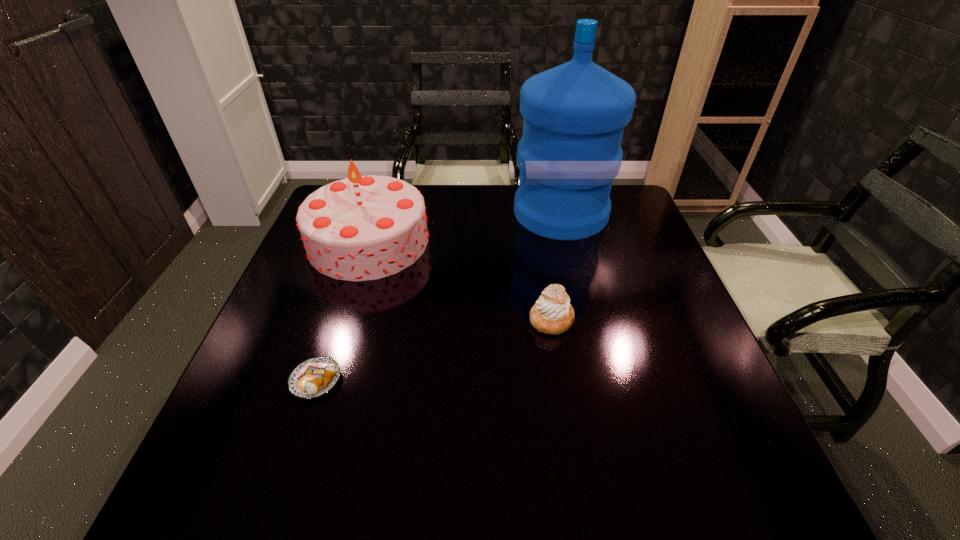
Where is `free point at the near left corner`? The width and height of the screenshot is (960, 540). free point at the near left corner is located at coordinates (221, 455).

Locate an element on the screen. vacant space at the near right corner of the desktop is located at coordinates (739, 476).

This screenshot has height=540, width=960. What are the coordinates of `free space between the tallest object and the birthday cake` in the screenshot? It's located at (465, 227).

You are a GUI agent. You are given a task and a screenshot of the screen. Output one action in this format:
    pyautogui.click(x=<x>, y=<y>)
    Task: Click on the free point between the third shortest object and the nearer pastry
    This screenshot has width=960, height=540.
    Given the screenshot: What is the action you would take?
    pyautogui.click(x=343, y=311)

Where is `free spot between the water jug and the birthday cake`? The height and width of the screenshot is (540, 960). free spot between the water jug and the birthday cake is located at coordinates (465, 227).

You are a GUI agent. You are given a task and a screenshot of the screen. Output one action in this format:
    pyautogui.click(x=<x>, y=<y>)
    Task: Click on the vacant space that's between the third shortest object and the taller pastry
    The width and height of the screenshot is (960, 540).
    Given the screenshot: What is the action you would take?
    pyautogui.click(x=460, y=280)

You are a GUI agent. You are given a task and a screenshot of the screen. Output one action in this format:
    pyautogui.click(x=<x>, y=<y>)
    Task: Click on the free space between the nearest object and the tallest object
    The width and height of the screenshot is (960, 540).
    Given the screenshot: What is the action you would take?
    pyautogui.click(x=438, y=297)

Find the location of a particular element. Image resolution: width=960 pixels, height=540 pixels. empty space that is in between the tallest object and the second shortest object is located at coordinates (556, 266).

Image resolution: width=960 pixels, height=540 pixels. I want to click on unoccupied position between the left pastry and the birthday cake, so click(x=343, y=311).

Identify the location of vacant area between the shortest object and the water jug. (438, 297).